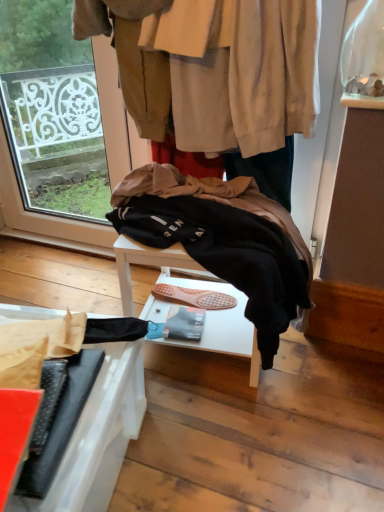
Question: Is black matte umbrella at lower left outside of dark blue jeans at center?

Choices:
 (A) no
 (B) yes

Answer: (B)

Question: Is the position of black matte umbrella at lower left less distant than that of dark blue jeans at center?

Choices:
 (A) yes
 (B) no

Answer: (A)

Question: Is black matte umbrella at lower left to the left of dark blue jeans at center from the viewer's perspective?

Choices:
 (A) no
 (B) yes

Answer: (B)

Question: Is black matte umbrella at lower left behind dark blue jeans at center?

Choices:
 (A) yes
 (B) no

Answer: (B)

Question: From a real-world perspective, is black matte umbrella at lower left positioned over dark blue jeans at center based on gravity?

Choices:
 (A) no
 (B) yes

Answer: (A)

Question: Would you say dark blue jeans at center is part of black matte umbrella at lower left's contents?

Choices:
 (A) no
 (B) yes

Answer: (A)

Question: Is dark blue jeans at center far away from black matte umbrella at lower left?

Choices:
 (A) no
 (B) yes

Answer: (A)

Question: Is dark blue jeans at center thinner than black matte umbrella at lower left?

Choices:
 (A) no
 (B) yes

Answer: (B)

Question: Is dark blue jeans at center placed right next to black matte umbrella at lower left?

Choices:
 (A) no
 (B) yes

Answer: (A)

Question: Can you confirm if dark blue jeans at center is shorter than black matte umbrella at lower left?

Choices:
 (A) no
 (B) yes

Answer: (B)

Question: From a real-world perspective, does dark blue jeans at center sit lower than black matte umbrella at lower left?

Choices:
 (A) no
 (B) yes

Answer: (A)

Question: Can we say dark blue jeans at center lies outside black matte umbrella at lower left?

Choices:
 (A) yes
 (B) no

Answer: (A)

Question: Does black fleece jacket at center come in front of black matte umbrella at lower left?

Choices:
 (A) no
 (B) yes

Answer: (A)